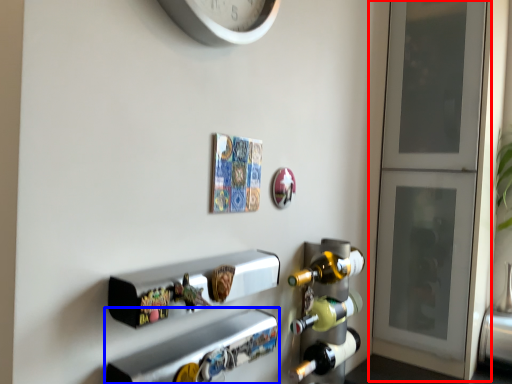
Question: Among these objects, which one is farthest to the camera, door (highlighted by a red box) or shelf (highlighted by a blue box)?

Choices:
 (A) door
 (B) shelf

Answer: (A)